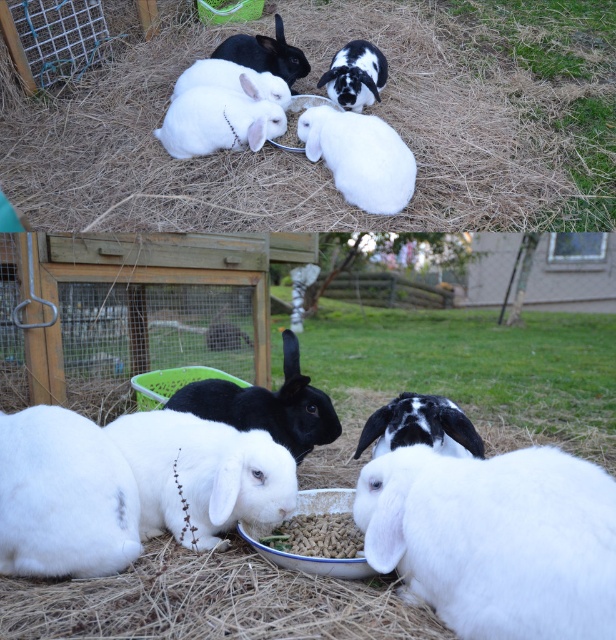
Can you confirm if white fluffy rabbit at lower left is bigger than white fluffy rabbit at upper left?

Incorrect, white fluffy rabbit at lower left is not larger than white fluffy rabbit at upper left.

In the scene shown: Who is shorter, white fluffy rabbit at lower left or white fluffy rabbit at upper left?

Standing shorter between the two is white fluffy rabbit at upper left.

Between point (68, 524) and point (285, 83), which one is positioned behind?

The point (285, 83) is behind.

What are the coordinates of `white fluffy rabbit at lower left` in the screenshot? It's located at (63, 497).

Does white fluffy rabbit at lower right have a larger size compared to black soft fur rabbit at upper center?

Yes, white fluffy rabbit at lower right is bigger than black soft fur rabbit at upper center.

Looking at this image, who is shorter, white fluffy rabbit at lower right or black soft fur rabbit at upper center?

Standing shorter between the two is black soft fur rabbit at upper center.

Image resolution: width=616 pixels, height=640 pixels. Find the location of `white fluffy rabbit at lower right`. white fluffy rabbit at lower right is located at coordinates (495, 540).

Is white fluffy rabbit at center above white fluffy rabbit at upper center?

No.

Is point (362, 147) behind point (233, 106)?

No, (362, 147) is in front of (233, 106).

At what (x,y) coordinates should I click in order to perform the action: click on white fluffy rabbit at center. Please return your answer as a coordinate pair (x, y). The width and height of the screenshot is (616, 640). Looking at the image, I should click on (360, 157).